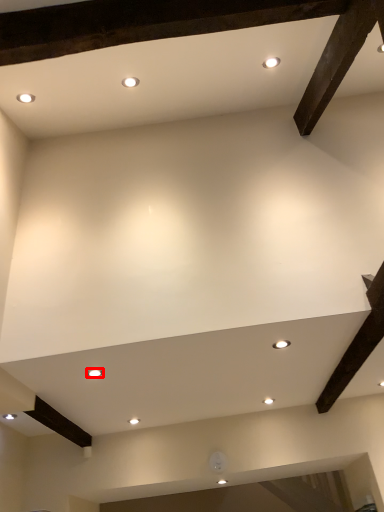
Question: Considering the relative positions of lighting (annotated by the red box) and lighting in the image provided, where is lighting (annotated by the red box) located with respect to the staircase?

Choices:
 (A) left
 (B) right

Answer: (A)